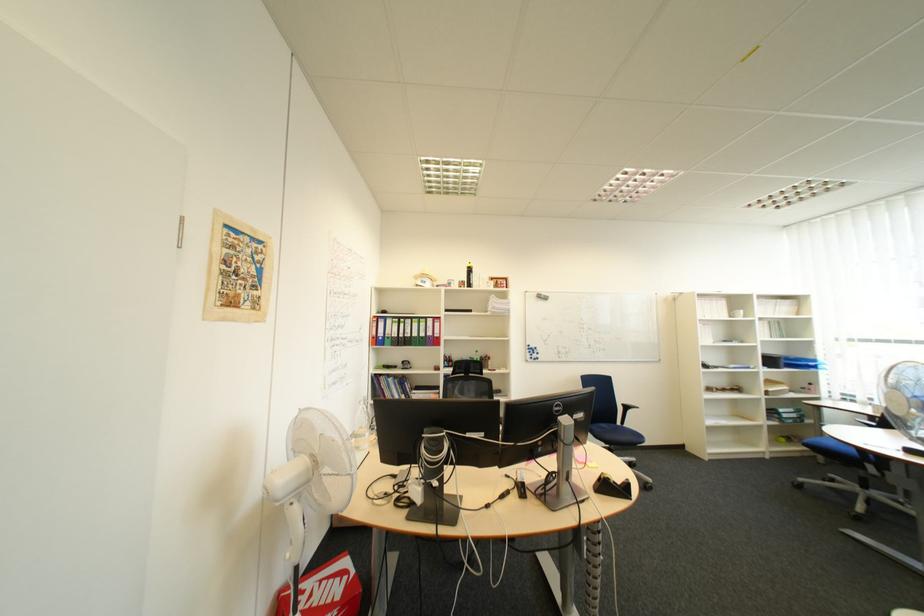
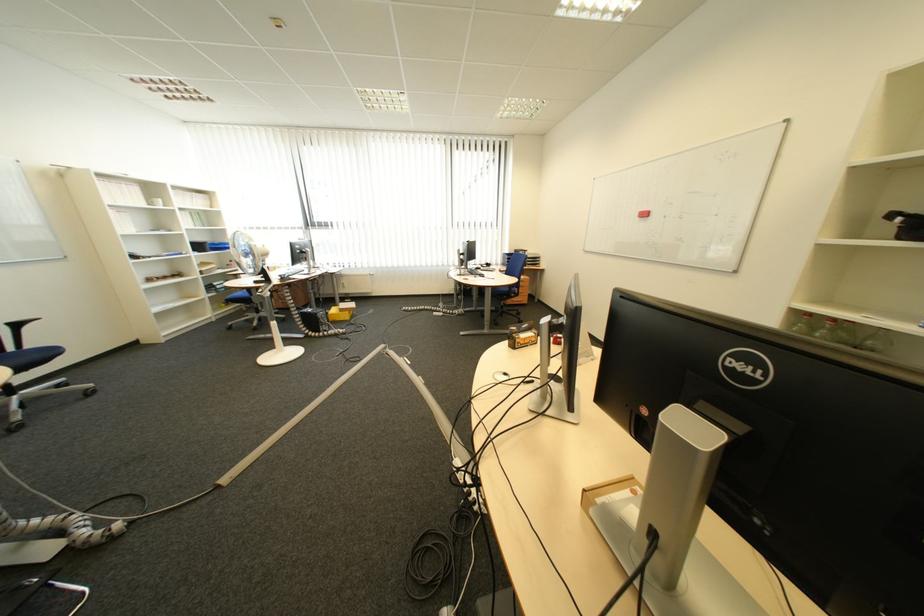
The images are taken continuously from a first-person perspective. In which direction is your viewpoint rotating?

The rotation direction of the camera is right-down.